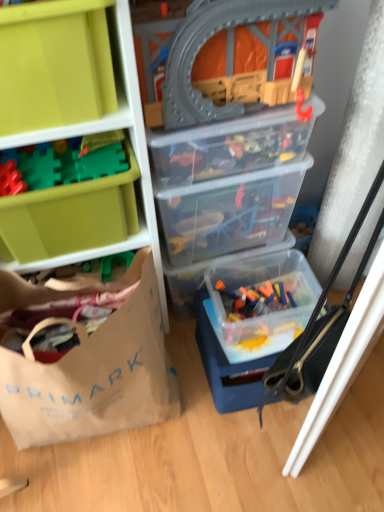
Question: From the image's perspective, is green plastic blocks at upper left, which appears as the second toy when viewed from the top, positioned above or below brown paper bag at lower left?

Choices:
 (A) below
 (B) above

Answer: (B)

Question: From a real-world perspective, is green plastic blocks at upper left, the 3th toy positioned from the right, physically located above or below brown paper bag at lower left?

Choices:
 (A) above
 (B) below

Answer: (A)

Question: Estimate the real-world distances between objects in this image. Which object is farther from the translucent plastic container at lower right, positioned as the 5th storage box in front-to-back order?

Choices:
 (A) green plastic blocks at upper left, which is counted as the first toy, starting from the left
 (B) matte green plastic storage box at upper left, placed as the first storage box when sorted from front to back
 (C) transparent plastic train set at upper center, positioned as the 2th toy in left-to-right order
 (D) green plastic storage box at left, the fifth storage box when ordered from back to front
 (E) transparent plastic storage box at center, which is counted as the third storage box, starting from the back

Answer: (B)

Question: Considering the real-world distances, which object is farthest from the brown paper bag at lower left?

Choices:
 (A) green plastic blocks at upper left, the second toy positioned from the front
 (B) translucent plastic container at lower right, the 2th storage box in the back-to-front sequence
 (C) green plastic storage box at left, acting as the 2th storage box starting from the front
 (D) transparent plastic train set at upper center, positioned as the 2th toy in left-to-right order
 (E) transparent plastic storage box at center, which is counted as the third storage box, starting from the back

Answer: (D)